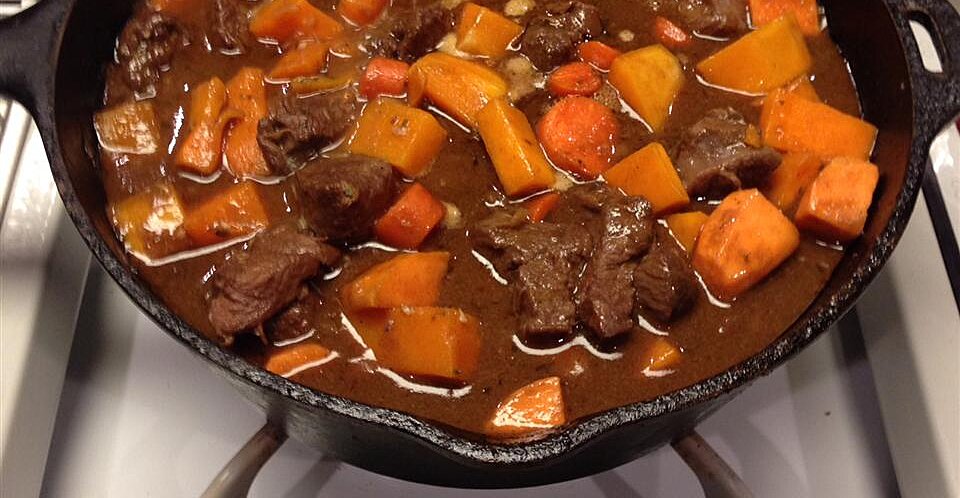
Identify the location of handle. (21, 42).